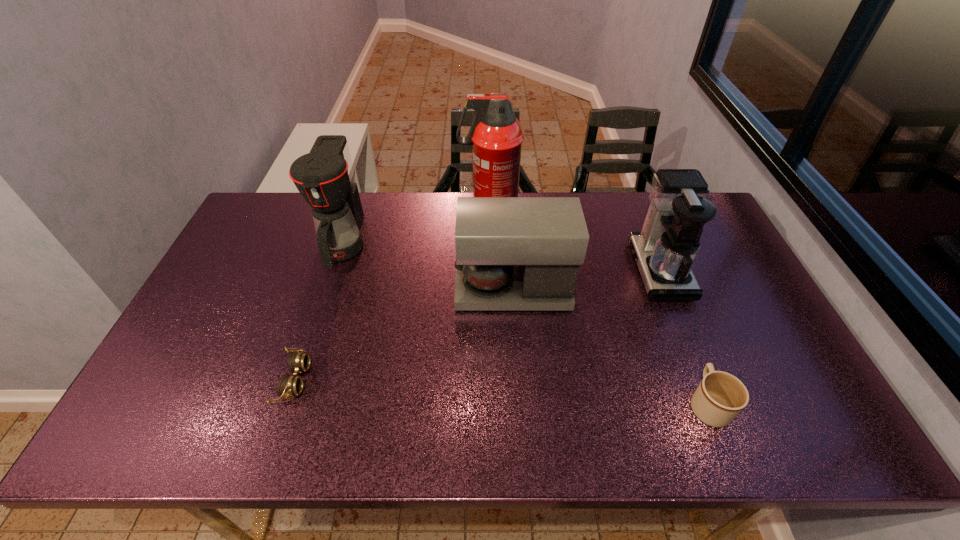
This screenshot has height=540, width=960. I want to click on free space located at the front of the rightmost coffee maker where the controls are located, so click(549, 270).

In order to click on vacant space located 0.060m at the front of the rightmost coffee maker where the controls are located in this screenshot , I will do `click(614, 270)`.

Identify the location of vacant region located 0.290m at the front of the rightmost coffee maker where the controls are located. (540, 270).

The height and width of the screenshot is (540, 960). In order to click on free space located on the carafe side of the second coffee maker from left to right in this screenshot , I will do `click(374, 290)`.

You are a GUI agent. You are given a task and a screenshot of the screen. Output one action in this format:
    pyautogui.click(x=<x>, y=<y>)
    Task: Click on the free region located on the carafe side of the second coffee maker from left to right
    
    Given the screenshot: What is the action you would take?
    pyautogui.click(x=385, y=290)

Where is `vacant region located on the carafe side of the second coffee maker from left to right`? This screenshot has height=540, width=960. vacant region located on the carafe side of the second coffee maker from left to right is located at coordinates (330, 290).

The height and width of the screenshot is (540, 960). I want to click on vacant area located 0.340m on the side of the second shortest object with the handle, so click(660, 281).

Where is `blank space located on the side of the second shortest object with the handle`? The image size is (960, 540). blank space located on the side of the second shortest object with the handle is located at coordinates (687, 354).

You are a GUI agent. You are given a task and a screenshot of the screen. Output one action in this format:
    pyautogui.click(x=<x>, y=<y>)
    Task: Click on the blank space located 0.120m on the side of the second shortest object with the handle
    This screenshot has height=540, width=960.
    Given the screenshot: What is the action you would take?
    click(683, 341)

Find the location of a particular element. The height and width of the screenshot is (540, 960). free space located 0.260m through the lenses of the goggles is located at coordinates (413, 380).